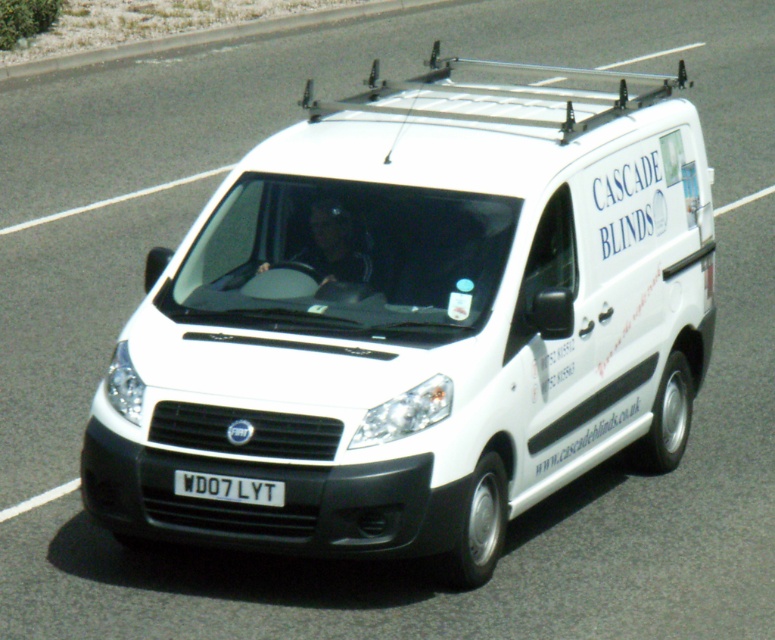
Does white matte van at center appear under white plastic license plate at center?

No.

Is white matte van at center closer to camera compared to white plastic license plate at center?

Yes, white matte van at center is in front of white plastic license plate at center.

This screenshot has width=775, height=640. Identify the location of white matte van at center. (417, 320).